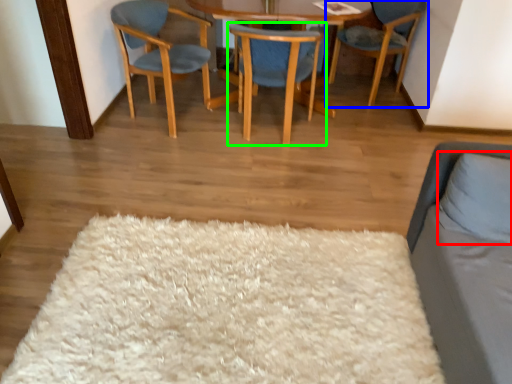
Question: Estimate the real-world distances between objects in this image. Which object is closer to pillow (highlighted by a red box), chair (highlighted by a blue box) or chair (highlighted by a green box)?

Choices:
 (A) chair
 (B) chair

Answer: (B)